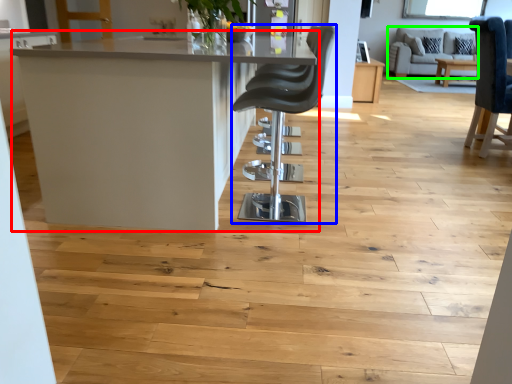
Question: Which is nearer to the table (highlighted by a red box)? chair (highlighted by a blue box) or couch (highlighted by a green box).

Choices:
 (A) chair
 (B) couch

Answer: (A)